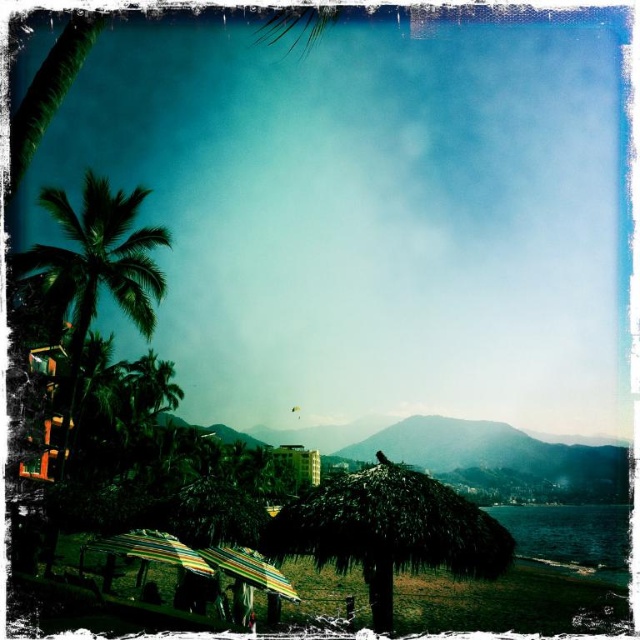
You are a beachgoer who wants to choose an umbrella that provides more shade. You see the thatched straw umbrella at center and the multicolored striped umbrella at center. Which one is taller?

The thatched straw umbrella at center is much taller than the multicolored striped umbrella at center, so it provides more shade.

You are standing at the center of the beach and see the point at coordinates (x=96, y=273). Which object is this point located on?

The point at coordinates (x=96, y=273) is located on the green leafy palm tree at left.